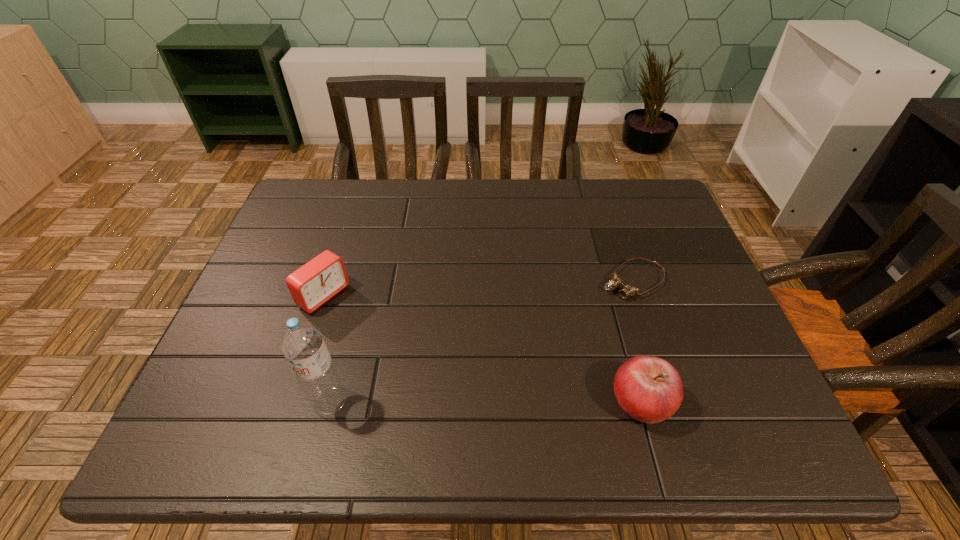
At what (x,y) coordinates should I click in order to perform the action: click on vacant spot on the desktop that is between the water bottle and the apple and is positioned on the front-facing side of the alarm clock. Please return your answer as a coordinate pair (x, y). Looking at the image, I should click on (476, 401).

You are a GUI agent. You are given a task and a screenshot of the screen. Output one action in this format:
    pyautogui.click(x=<x>, y=<y>)
    Task: Click on the free space on the desktop that is between the tallest object and the apple and is positioned on the front lenses and sides of the goggles
    
    Given the screenshot: What is the action you would take?
    pyautogui.click(x=465, y=401)